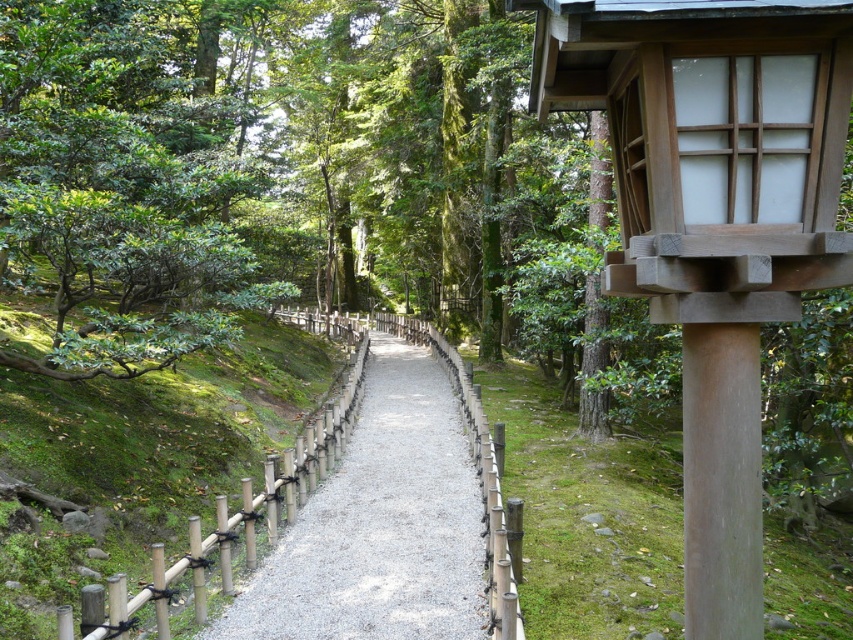
Does point (148, 77) lie in front of point (706, 506)?

No.

Is green leafy bush at left above smooth beige pole at right?

Yes, green leafy bush at left is above smooth beige pole at right.

Image resolution: width=853 pixels, height=640 pixels. Identify the location of green leafy bush at left. (122, 180).

Who is more distant from viewer, (245, 605) or (735, 632)?

The point (245, 605) is more distant.

Can you confirm if gravel at center is shorter than smooth beige pole at right?

In fact, gravel at center may be taller than smooth beige pole at right.

Between point (438, 339) and point (735, 627), which one is positioned in front?

Point (735, 627)

Where is `gravel at center`? Image resolution: width=853 pixels, height=640 pixels. gravel at center is located at coordinates (384, 522).

Is green leafy bush at left above gravel at center?

Correct, green leafy bush at left is located above gravel at center.

You are a GUI agent. You are given a task and a screenshot of the screen. Output one action in this format:
    pyautogui.click(x=<x>, y=<y>)
    Task: Click on the green leafy bush at left
    Image resolution: width=853 pixels, height=640 pixels.
    Given the screenshot: What is the action you would take?
    pyautogui.click(x=122, y=180)

Who is more distant from viewer, (74, 211) or (357, 611)?

Point (74, 211)

Find the location of a particular element. green leafy bush at left is located at coordinates (122, 180).